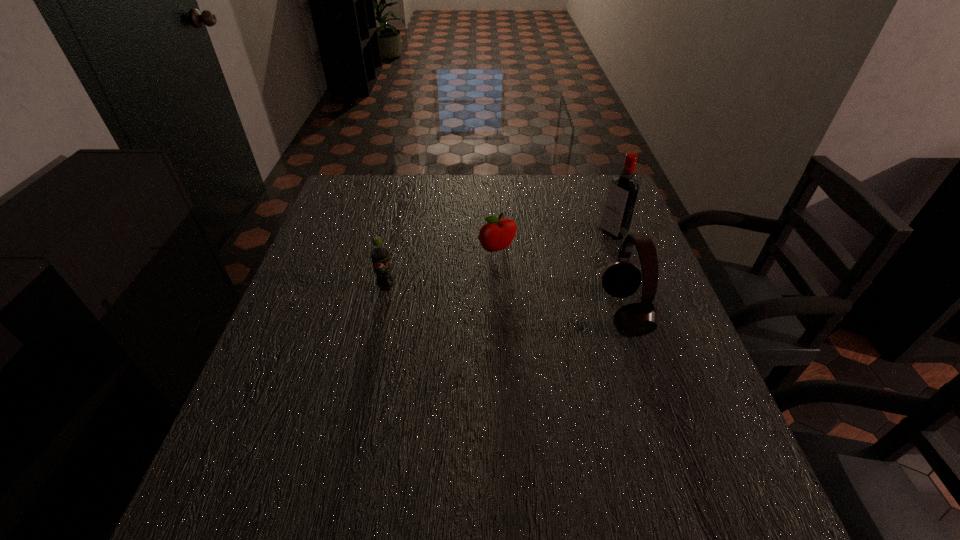
Identify the location of blank area at the right edge. (580, 221).

Image resolution: width=960 pixels, height=540 pixels. Identify the location of vacant area at the far left corner of the desktop. tap(337, 200).

What are the coordinates of `vacant region at the far right corner of the desktop` in the screenshot? It's located at (588, 198).

In the image, there is a desktop. Identify the location of vacant space at the near right corner. (666, 443).

Find the location of `free space between the second shortest object and the farthest object`. free space between the second shortest object and the farthest object is located at coordinates (499, 261).

Identify the location of vacant space in between the shortest object and the second tallest object. This screenshot has width=960, height=540. (561, 281).

At what (x,y) coordinates should I click in order to perform the action: click on vacant area that lies between the second shortest object and the third shortest object. Please return your answer as a coordinate pair (x, y). Looking at the image, I should click on (505, 300).

You are a GUI agent. You are given a task and a screenshot of the screen. Output one action in this format:
    pyautogui.click(x=<x>, y=<y>)
    Task: Click on the vacant area that lies between the second shortest object and the farthest object
    This screenshot has height=540, width=960.
    Given the screenshot: What is the action you would take?
    pyautogui.click(x=499, y=261)

What are the coordinates of `free spot between the headset and the shortest object` in the screenshot? It's located at (561, 281).

Where is `vacant space that is in between the second tallest object and the shortest object`? vacant space that is in between the second tallest object and the shortest object is located at coordinates (561, 281).